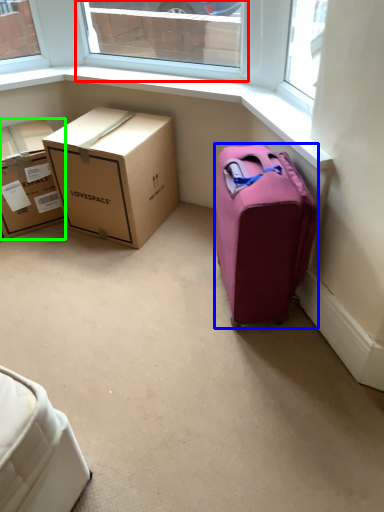
Question: Which object is positioned closest to window (highlighted by a red box)? Select from suitcase (highlighted by a blue box) and box (highlighted by a green box).

Choices:
 (A) suitcase
 (B) box

Answer: (B)